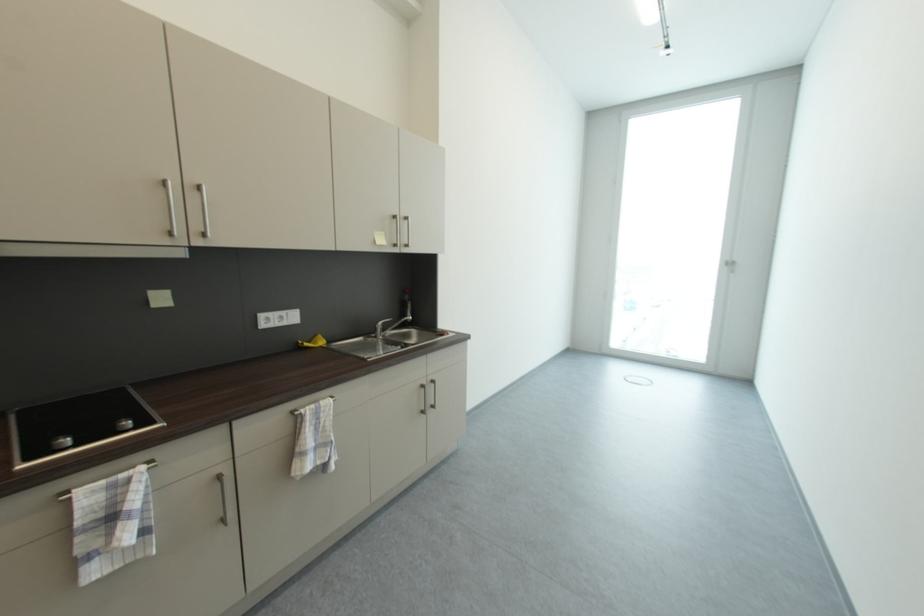
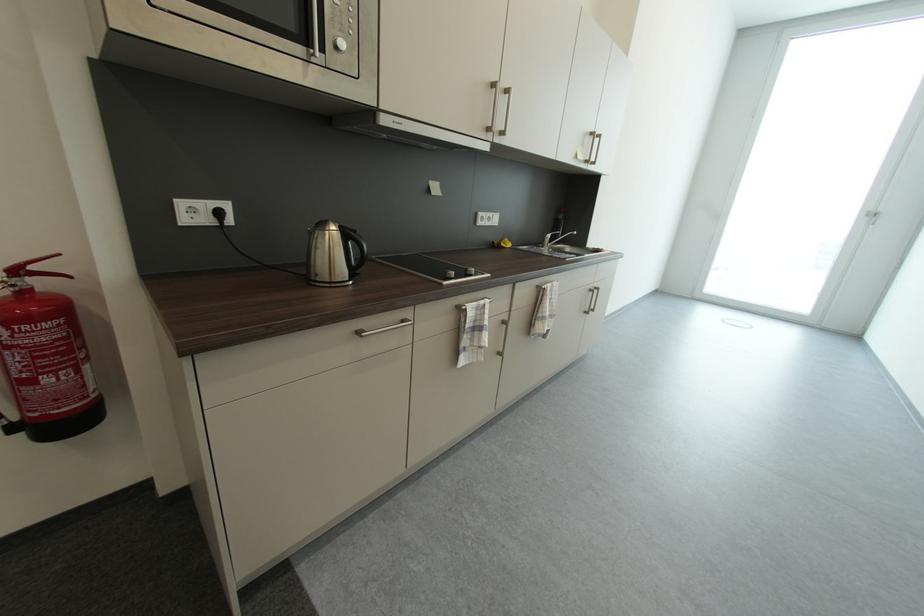
Where in the second image is the point corresponding to point (73, 443) from the first image?

(458, 275)